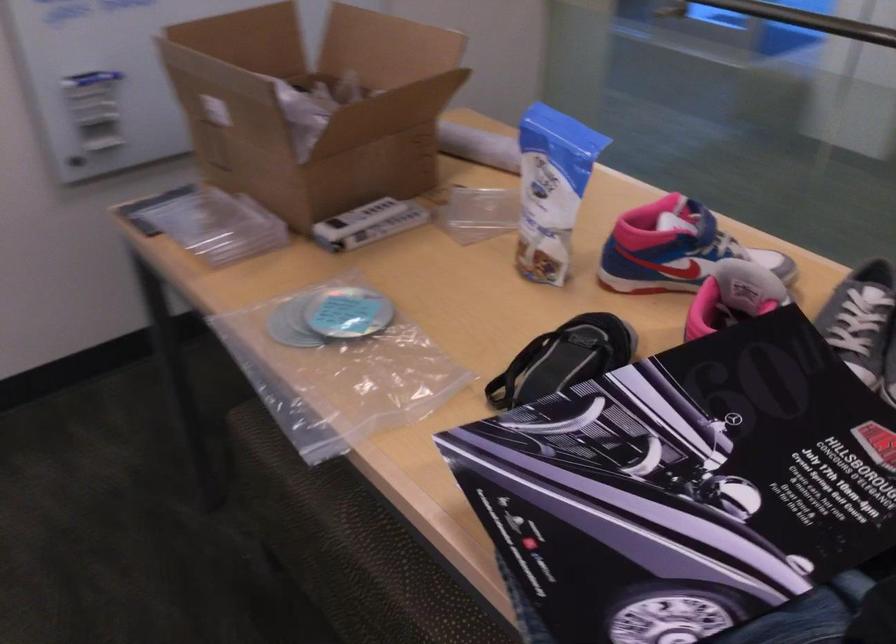
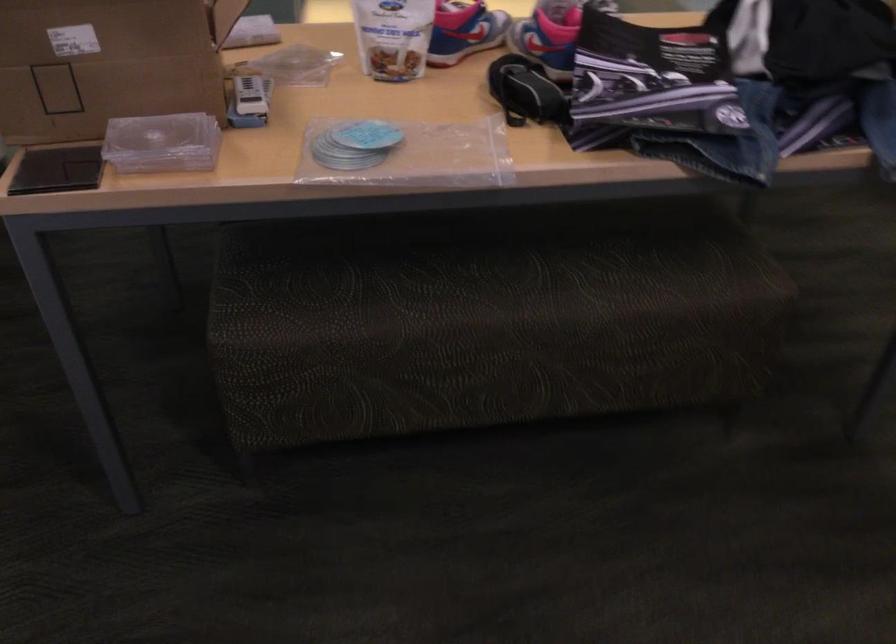
Locate, in the second image, the point that corresponds to (x=537, y=230) in the first image.

(392, 37)